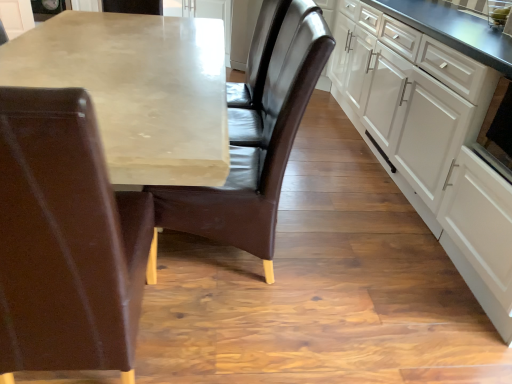
What do you see at coordinates (66, 240) in the screenshot? The height and width of the screenshot is (384, 512). I see `leather chair at left, which is the first chair from left to right` at bounding box center [66, 240].

What do you see at coordinates (498, 131) in the screenshot?
I see `black glossy oven at right` at bounding box center [498, 131].

Image resolution: width=512 pixels, height=384 pixels. I want to click on leather chair at left, which appears as the 2th chair when viewed from the right, so click(x=66, y=240).

From a real-world perspective, is black glossy oven at right on top of brown leather chair at center, which is the second chair from left to right?

Yes, from a real-world perspective, black glossy oven at right is above brown leather chair at center, which is the second chair from left to right.

Is there a large distance between black glossy oven at right and brown leather chair at center, which is the second chair from left to right?

Actually, black glossy oven at right and brown leather chair at center, which is the second chair from left to right, are a little close together.

Looking at this image, looking at their sizes, would you say black glossy oven at right is wider or thinner than brown leather chair at center, which is the second chair from left to right?

In the image, black glossy oven at right appears to be more narrow than brown leather chair at center, which is the second chair from left to right.

Is black glossy oven at right closer to camera compared to brown leather chair at center, which is counted as the 1th chair, starting from the right?

No, black glossy oven at right is further to the viewer.

Is brown leather chair at center, which is the second chair from left to right, outside of matte concrete table at center?

No.

Does brown leather chair at center, which is counted as the 1th chair, starting from the right, have a lesser height compared to matte concrete table at center?

No, brown leather chair at center, which is counted as the 1th chair, starting from the right, is not shorter than matte concrete table at center.

Starting from the matte concrete table at center, which chair is the 2nd one to the right? Please provide its 2D coordinates.

[(256, 146)]

Is brown leather chair at center, which is the second chair from left to right, further to the viewer compared to matte concrete table at center?

Yes, brown leather chair at center, which is the second chair from left to right, is further from the viewer.

The width and height of the screenshot is (512, 384). In order to click on chair located above the leather chair at left, which appears as the 2th chair when viewed from the right (from a real-world perspective) in this screenshot , I will do `click(256, 146)`.

From a real-world perspective, is leather chair at left, which appears as the 2th chair when viewed from the right, located higher than brown leather chair at center, which is the second chair from left to right?

No, from a real-world perspective, leather chair at left, which appears as the 2th chair when viewed from the right, is not on top of brown leather chair at center, which is the second chair from left to right.

Which point is more forward, (x=42, y=109) or (x=268, y=241)?

The point (x=42, y=109) is closer to the camera.

Is white matte cabinet at right next to leather chair at left, which is the first chair from left to right?

No, white matte cabinet at right is not next to leather chair at left, which is the first chair from left to right.

Considering the sizes of white matte cabinet at right and leather chair at left, which is the first chair from left to right, in the image, is white matte cabinet at right taller or shorter than leather chair at left, which is the first chair from left to right,?

Clearly, white matte cabinet at right is shorter compared to leather chair at left, which is the first chair from left to right.

Can leather chair at left, which is the first chair from left to right, be found inside white matte cabinet at right?

No.

Does white matte cabinet at right appear on the left side of leather chair at left, which is the first chair from left to right?

No.

Would you say brown leather chair at center, which is counted as the 1th chair, starting from the right, contains black glossy oven at right?

That's incorrect, black glossy oven at right is not inside brown leather chair at center, which is counted as the 1th chair, starting from the right.

Does brown leather chair at center, which is the second chair from left to right, turn towards black glossy oven at right?

No, brown leather chair at center, which is the second chair from left to right, is not aimed at black glossy oven at right.

Which object is positioned more to the left, brown leather chair at center, which is counted as the 1th chair, starting from the right, or black glossy oven at right?

brown leather chair at center, which is counted as the 1th chair, starting from the right, is more to the left.

Is brown leather chair at center, which is counted as the 1th chair, starting from the right, positioned far away from black glossy oven at right?

No, there isn't a large distance between brown leather chair at center, which is counted as the 1th chair, starting from the right, and black glossy oven at right.

Would you say white matte cabinet at right is part of brown leather chair at center, which is the second chair from left to right,'s contents?

No, white matte cabinet at right is not inside brown leather chair at center, which is the second chair from left to right.

What's the angular difference between brown leather chair at center, which is counted as the 1th chair, starting from the right, and white matte cabinet at right's facing directions?

The angular difference between brown leather chair at center, which is counted as the 1th chair, starting from the right, and white matte cabinet at right is 7.04 degrees.

Between brown leather chair at center, which is counted as the 1th chair, starting from the right, and white matte cabinet at right, which one appears on the left side from the viewer's perspective?

From the viewer's perspective, brown leather chair at center, which is counted as the 1th chair, starting from the right, appears more on the left side.

Is brown leather chair at center, which is counted as the 1th chair, starting from the right, bigger than white matte cabinet at right?

No.

Is white matte cabinet at right in contact with brown leather chair at center, which is the second chair from left to right?

No, white matte cabinet at right is not in contact with brown leather chair at center, which is the second chair from left to right.

In the scene shown: Is white matte cabinet at right bigger or smaller than brown leather chair at center, which is the second chair from left to right?

Clearly, white matte cabinet at right is larger in size than brown leather chair at center, which is the second chair from left to right.

Can you tell me how much white matte cabinet at right and brown leather chair at center, which is the second chair from left to right, differ in facing direction?

white matte cabinet at right and brown leather chair at center, which is the second chair from left to right, are facing 7.04 degrees away from each other.

Based on the photo, is white matte cabinet at right located outside brown leather chair at center, which is the second chair from left to right?

Yes, white matte cabinet at right is located beyond the bounds of brown leather chair at center, which is the second chair from left to right.

Starting from the black glossy oven at right, which chair is the 1st one in front? Please provide its 2D coordinates.

[(256, 146)]

This screenshot has height=384, width=512. Identify the location of chair lying behind the matte concrete table at center. (256, 146).

Looking at the image, which one is located further to leather chair at left, which is the first chair from left to right, brown leather chair at center, which is counted as the 1th chair, starting from the right, or white matte cabinet at right?

white matte cabinet at right.

When comparing their distances from black glossy oven at right, does matte concrete table at center or white matte cabinet at right seem further?

→ The object further to black glossy oven at right is matte concrete table at center.

From the image, which object appears to be farther from white matte cabinet at right, black glossy oven at right or brown leather chair at center, which is counted as the 1th chair, starting from the right?

brown leather chair at center, which is counted as the 1th chair, starting from the right, is further to white matte cabinet at right.

Estimate the real-world distances between objects in this image. Which object is further from brown leather chair at center, which is the second chair from left to right, matte concrete table at center or leather chair at left, which appears as the 2th chair when viewed from the right?

leather chair at left, which appears as the 2th chair when viewed from the right, lies further to brown leather chair at center, which is the second chair from left to right, than the other object.

Based on their spatial positions, is black glossy oven at right or matte concrete table at center closer to white matte cabinet at right?

Based on the image, black glossy oven at right appears to be nearer to white matte cabinet at right.

When comparing their distances from leather chair at left, which appears as the 2th chair when viewed from the right, does black glossy oven at right or matte concrete table at center seem further?

black glossy oven at right lies further to leather chair at left, which appears as the 2th chair when viewed from the right, than the other object.

When comparing their distances from black glossy oven at right, does matte concrete table at center or leather chair at left, which appears as the 2th chair when viewed from the right, seem further?

leather chair at left, which appears as the 2th chair when viewed from the right.

Based on their spatial positions, is black glossy oven at right or white matte cabinet at right closer to matte concrete table at center?

Based on the image, white matte cabinet at right appears to be nearer to matte concrete table at center.

Locate an element on the screen. appliance located between leather chair at left, which appears as the 2th chair when viewed from the right, and white matte cabinet at right in the left-right direction is located at coordinates click(x=498, y=131).

The height and width of the screenshot is (384, 512). What are the coordinates of `chair located between leather chair at left, which is the first chair from left to right, and black glossy oven at right in the left-right direction` in the screenshot? It's located at (256, 146).

Locate an element on the screen. Image resolution: width=512 pixels, height=384 pixels. chair situated between matte concrete table at center and brown leather chair at center, which is the second chair from left to right, from left to right is located at coordinates (66, 240).

Locate an element on the screen. This screenshot has height=384, width=512. appliance located between brown leather chair at center, which is counted as the 1th chair, starting from the right, and white matte cabinet at right in the left-right direction is located at coordinates (498, 131).